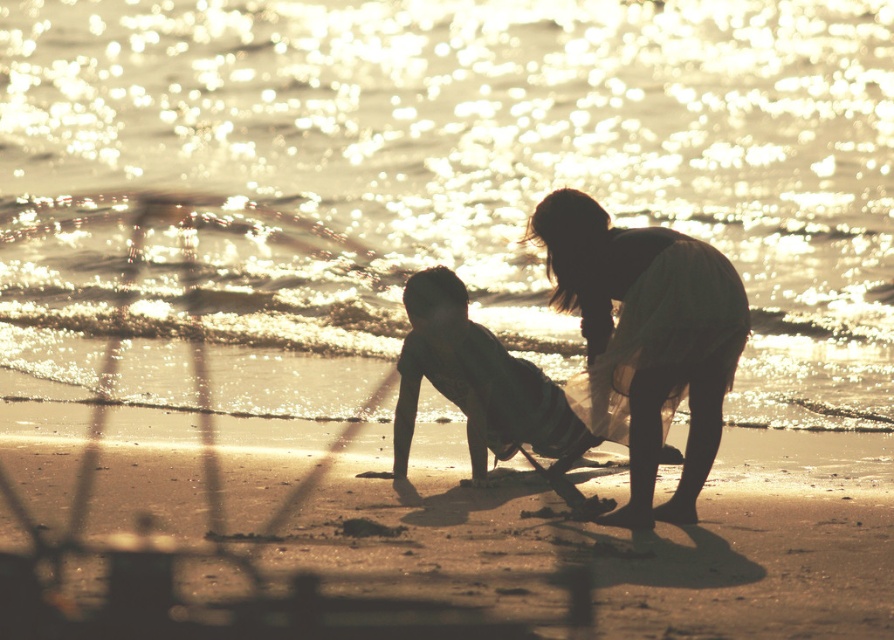
Question: Is silhouette dress at center below silhouette skin child at center?

Choices:
 (A) no
 (B) yes

Answer: (A)

Question: Estimate the real-world distances between objects in this image. Which object is farther from the sparkling golden water at center?

Choices:
 (A) silhouette dress at center
 (B) smooth sand at lower center
 (C) silhouette skin child at center

Answer: (B)

Question: Which point is closer to the camera taking this photo?

Choices:
 (A) (704, 320)
 (B) (420, 296)
 (C) (39, 19)
 (D) (842, 636)

Answer: (D)

Question: Which point is farther from the camera taking this photo?

Choices:
 (A) (677, 346)
 (B) (736, 515)
 (C) (399, 470)

Answer: (C)

Question: Where is sparkling golden water at center located in relation to silhouette skin child at center in the image?

Choices:
 (A) left
 (B) right

Answer: (A)

Question: In this image, where is silhouette dress at center located relative to silhouette skin child at center?

Choices:
 (A) right
 (B) left

Answer: (A)